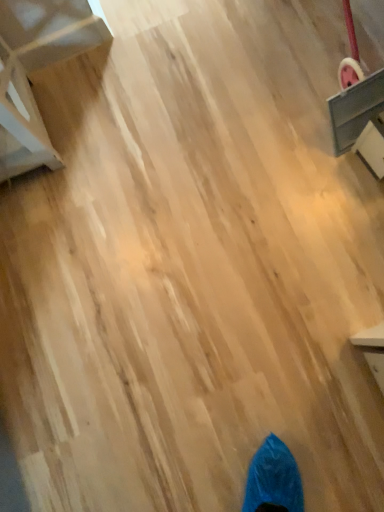
Question: Can you confirm if white matte chair at upper left, positioned as the 1th furniture in left-to-right order, is taller than gray fabric drawer at upper right, arranged as the 1th furniture when viewed from the right?

Choices:
 (A) no
 (B) yes

Answer: (A)

Question: Does white matte chair at upper left, the second furniture viewed from the right, appear on the left side of gray fabric drawer at upper right, arranged as the 1th furniture when viewed from the right?

Choices:
 (A) yes
 (B) no

Answer: (A)

Question: Can you confirm if white matte chair at upper left, positioned as the 1th furniture in left-to-right order, is thinner than gray fabric drawer at upper right, arranged as the 1th furniture when viewed from the right?

Choices:
 (A) yes
 (B) no

Answer: (A)

Question: Can we say white matte chair at upper left, positioned as the 1th furniture in left-to-right order, lies outside gray fabric drawer at upper right, arranged as the 1th furniture when viewed from the right?

Choices:
 (A) no
 (B) yes

Answer: (B)

Question: Considering the relative sizes of white matte chair at upper left, the second furniture viewed from the right, and gray fabric drawer at upper right, arranged as the 1th furniture when viewed from the right, in the image provided, is white matte chair at upper left, the second furniture viewed from the right, smaller than gray fabric drawer at upper right, arranged as the 1th furniture when viewed from the right,?

Choices:
 (A) no
 (B) yes

Answer: (A)

Question: Can you confirm if white matte chair at upper left, positioned as the 1th furniture in left-to-right order, is shorter than gray fabric drawer at upper right, positioned as the 2th furniture in left-to-right order?

Choices:
 (A) yes
 (B) no

Answer: (A)

Question: Is gray fabric drawer at upper right, arranged as the 1th furniture when viewed from the right, positioned in front of white matte chair at upper left, positioned as the 1th furniture in left-to-right order?

Choices:
 (A) no
 (B) yes

Answer: (A)

Question: From the image's perspective, is gray fabric drawer at upper right, positioned as the 2th furniture in left-to-right order, above white matte chair at upper left, the second furniture viewed from the right?

Choices:
 (A) yes
 (B) no

Answer: (A)

Question: Considering the relative sizes of gray fabric drawer at upper right, arranged as the 1th furniture when viewed from the right, and white matte chair at upper left, positioned as the 1th furniture in left-to-right order, in the image provided, is gray fabric drawer at upper right, arranged as the 1th furniture when viewed from the right, taller than white matte chair at upper left, positioned as the 1th furniture in left-to-right order,?

Choices:
 (A) yes
 (B) no

Answer: (A)

Question: Is gray fabric drawer at upper right, positioned as the 2th furniture in left-to-right order, directly adjacent to white matte chair at upper left, the second furniture viewed from the right?

Choices:
 (A) no
 (B) yes

Answer: (A)

Question: From the image's perspective, is gray fabric drawer at upper right, arranged as the 1th furniture when viewed from the right, located beneath white matte chair at upper left, positioned as the 1th furniture in left-to-right order?

Choices:
 (A) yes
 (B) no

Answer: (B)

Question: From a real-world perspective, is gray fabric drawer at upper right, positioned as the 2th furniture in left-to-right order, physically below white matte chair at upper left, the second furniture viewed from the right?

Choices:
 (A) yes
 (B) no

Answer: (A)

Question: Considering the positions of gray fabric drawer at upper right, positioned as the 2th furniture in left-to-right order, and white matte chair at upper left, the second furniture viewed from the right, in the image, is gray fabric drawer at upper right, positioned as the 2th furniture in left-to-right order, wider or thinner than white matte chair at upper left, the second furniture viewed from the right,?

Choices:
 (A) wide
 (B) thin

Answer: (A)